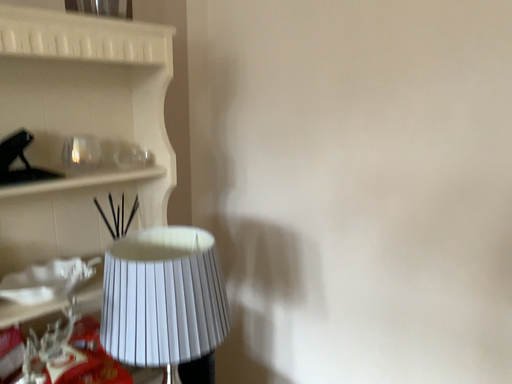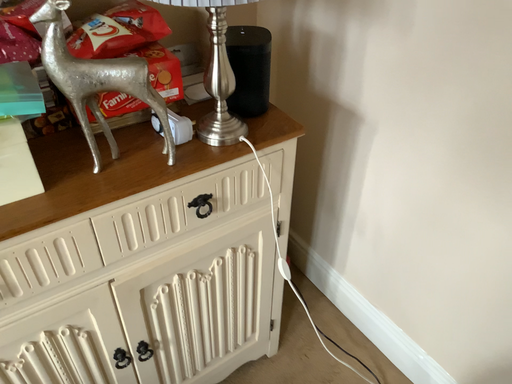
Question: Which way did the camera rotate in the video?

Choices:
 (A) rotated right
 (B) rotated left

Answer: (B)